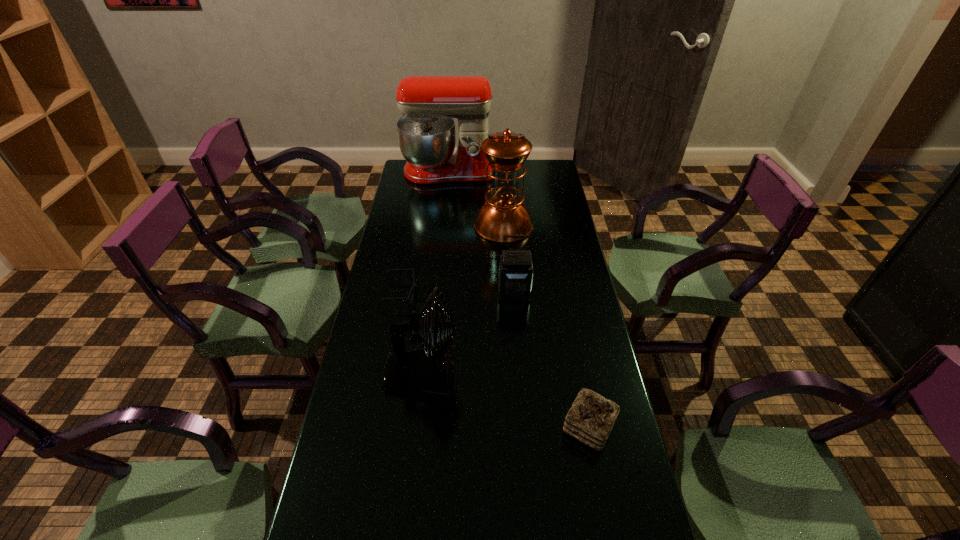
Identify the location of the farthest object. (426, 133).

Identify the location of the fifth nearest object. This screenshot has height=540, width=960. (502, 214).

In order to click on the fourth shortest object in this screenshot , I will do `click(429, 371)`.

Where is `lantern`? lantern is located at coordinates (515, 274).

Where is `chocolate cake`? This screenshot has width=960, height=540. chocolate cake is located at coordinates (591, 418).

Locate an element on the screen. Image resolution: width=960 pixels, height=540 pixels. spectacles is located at coordinates (414, 285).

The image size is (960, 540). What are the coordinates of `blank space located 0.310m on the front-facing side of the mixer` in the screenshot? It's located at (443, 227).

I want to click on vacant space located on the back of the oil lamp, so click(x=500, y=168).

I want to click on vacant point located in front of the fourth shortest object to blow air, so click(538, 374).

The height and width of the screenshot is (540, 960). Identify the location of free location located on the front-facing side of the third shortest object. (517, 332).